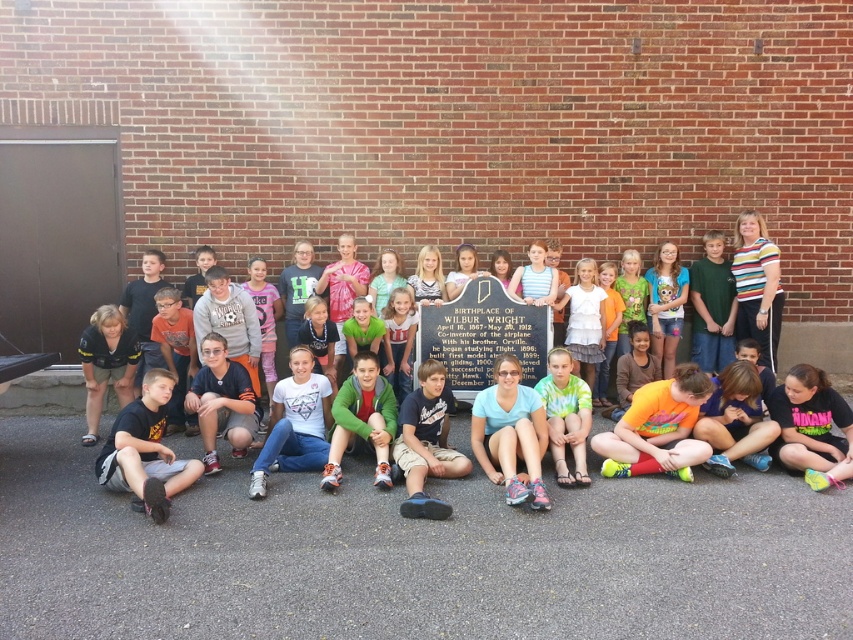
Is light blue t-shirt at center positioned in front of tie-dye fabric shorts at center?

Yes, it is.

Is light blue t-shirt at center wider than tie-dye fabric shorts at center?

Indeed, light blue t-shirt at center has a greater width compared to tie-dye fabric shorts at center.

Identify the location of light blue t-shirt at center. (509, 433).

Does light blue t-shirt at center have a lesser height compared to green tie-dye shirt at center?

In fact, light blue t-shirt at center may be taller than green tie-dye shirt at center.

Describe the element at coordinates (509, 433) in the screenshot. The width and height of the screenshot is (853, 640). I see `light blue t-shirt at center` at that location.

In order to click on light blue t-shirt at center in this screenshot , I will do `click(509, 433)`.

The height and width of the screenshot is (640, 853). I want to click on light blue t-shirt at center, so click(509, 433).

Which is in front, point (560, 374) or point (834, 328)?

Point (560, 374)

Does point (564, 371) lie in front of point (833, 381)?

Yes, it is in front of point (833, 381).

You are a GUI agent. You are given a task and a screenshot of the screen. Output one action in this format:
    pyautogui.click(x=<x>, y=<y>)
    Task: Click on the tie-dye fabric shorts at center
    The height and width of the screenshot is (640, 853).
    Given the screenshot: What is the action you would take?
    pyautogui.click(x=566, y=417)